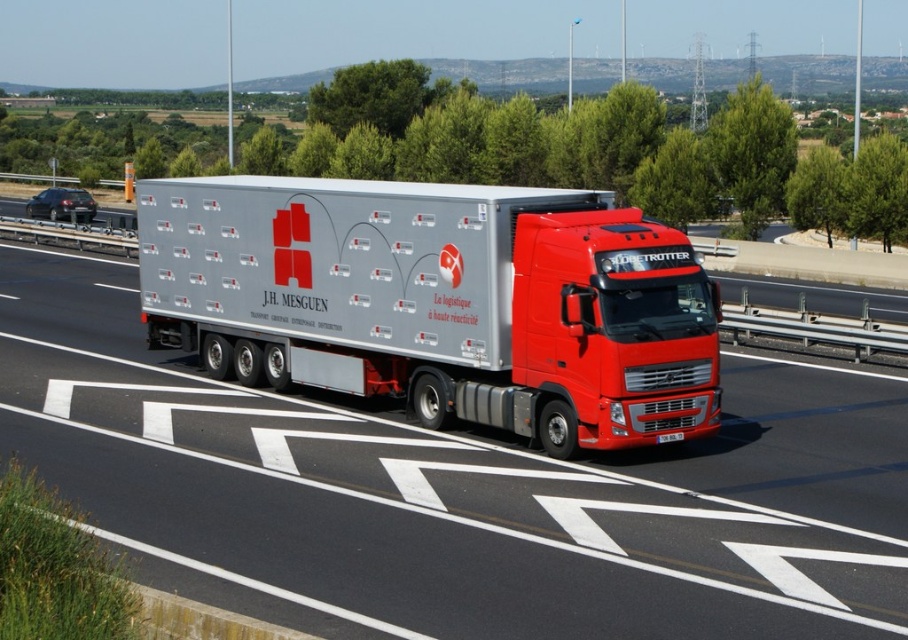
You are a traffic control system analyzing the position of vehicles on a highway. The silver metallic truck at center is part of your surveillance. Based on its coordinates, can you determine whether it is positioned in the rightmost lane of the highway?

The silver metallic truck at center is positioned at coordinates point (459, 490), which corresponds to the rightmost lane of the highway.

You are a traffic officer observing the highway scene. There is a point marked at coordinates (x=459, y=490). What object in the scene is located at that point?

The point at coordinates (x=459, y=490) corresponds to the silver metallic truck at center.

You are driving a car that is 4.5 meters long. You want to safely pass a large red Volvo truck and its trailer on a highway where the passing lane is only 4.8 meters wide. Can you fit your car between the silver metallic truck at center and the silver metallic trailer truck at center while passing?

The distance between the silver metallic truck at center and the silver metallic trailer truck at center is 2.01 meters. Since your car is 4.5 meters long and the passing lane is 4.8 meters wide, there is insufficient space to safely pass as the combined length of the truck and trailer exceeds the available width. However, this calculation might be incorrect because the distance between the truck and trailer is the gap, not their combined length. The actual combined length would be the truck length plus the